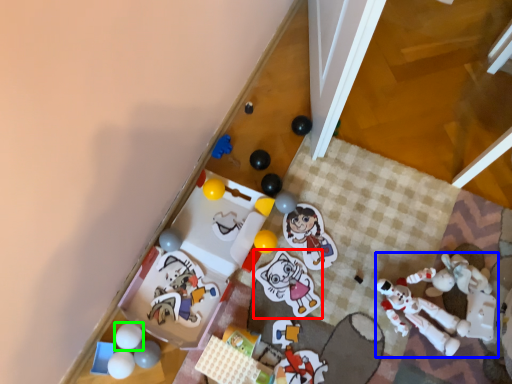
Question: Based on their relative distances, which object is farther from toy (highlighted by a red box)? Choose from toy (highlighted by a blue box) and toy (highlighted by a green box).

Choices:
 (A) toy
 (B) toy

Answer: (B)